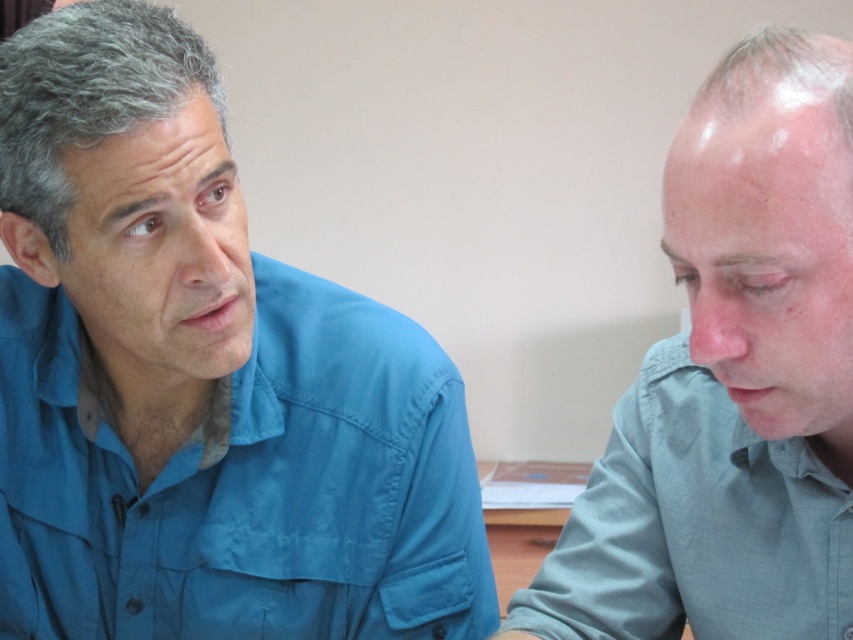
You are a tailor who needs to determine which shirt requires more fabric for alterations. Based on the image, which of the two shirts, the blue fabric shirt at left or the gray matte shirt at right, would need more fabric due to its size?

The blue fabric shirt at left is bigger than the gray matte shirt at right, so it would require more fabric for alterations.

You are a tailor who needs to determine which shirt requires more fabric for alterations. Based on the image, which of the two shirts, the blue fabric shirt at left or the light blue cotton shirt at right, would need more fabric due to its size?

The blue fabric shirt at left is bigger than the light blue cotton shirt at right, so it would require more fabric for alterations.

In the scene shown: You are a tailor measuring shirts for alterations. You have a blue fabric shirt at left and a gray matte shirt at right. Which shirt requires a longer sleeve length based on their heights?

The blue fabric shirt at left has a greater height compared to gray matte shirt at right, so it likely requires a longer sleeve length.